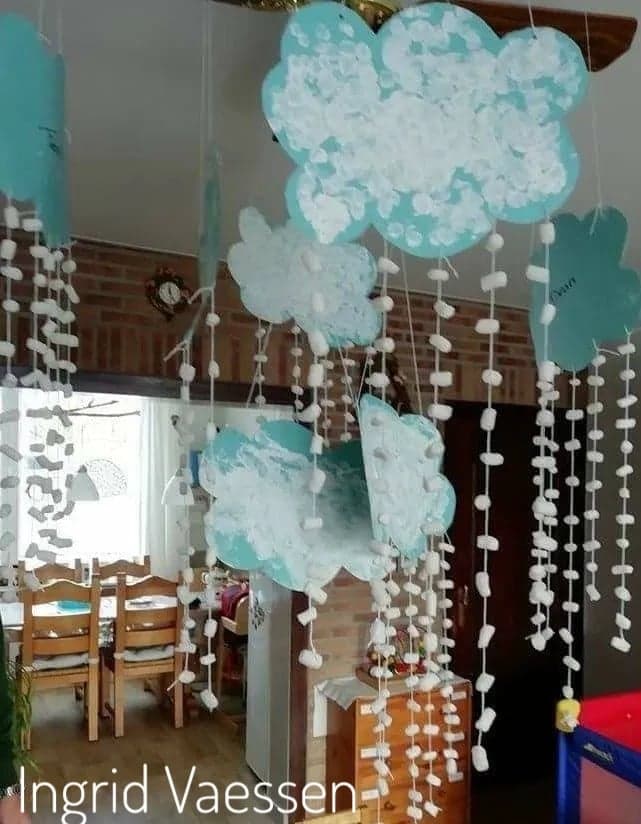
This screenshot has width=641, height=824. I want to click on chair, so click(63, 596), click(129, 590), click(117, 567), click(63, 564).